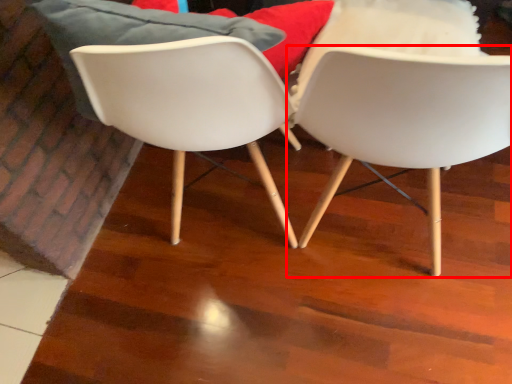
Question: From the image's perspective, where is chair (annotated by the red box) located relative to chair?

Choices:
 (A) below
 (B) above

Answer: (A)